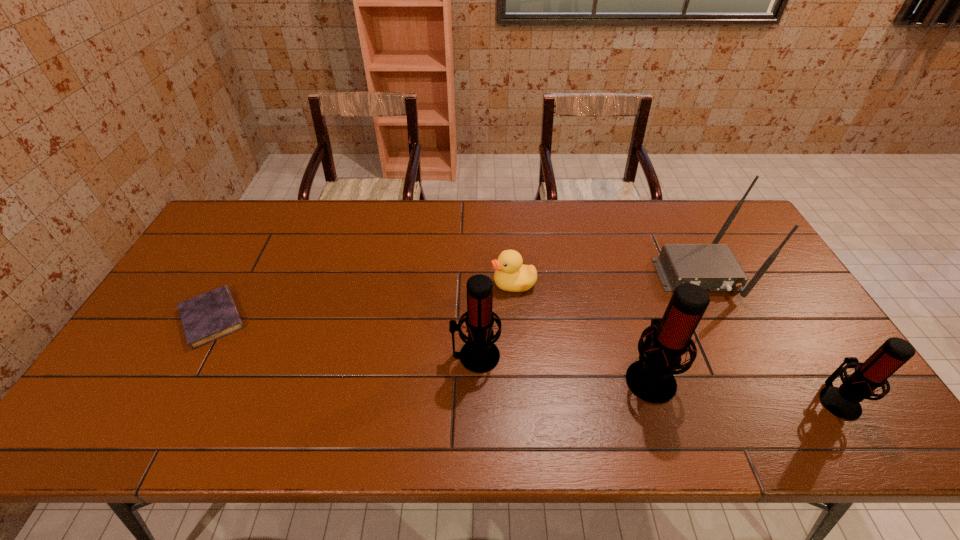
Where is `vacant space at the far edge`? The width and height of the screenshot is (960, 540). vacant space at the far edge is located at coordinates (418, 221).

This screenshot has height=540, width=960. I want to click on blank space at the near edge of the desktop, so click(732, 401).

In the image, there is a desktop. Identify the location of free space at the left edge. The width and height of the screenshot is (960, 540). (195, 261).

In the image, there is a desktop. At what (x,y) coordinates should I click in order to perform the action: click on vacant space at the right edge. Please return your answer as a coordinate pair (x, y). Image resolution: width=960 pixels, height=540 pixels. Looking at the image, I should click on (798, 327).

Where is `vacant space at the far left corner`? vacant space at the far left corner is located at coordinates (243, 201).

Where is `free space at the near right corner`? free space at the near right corner is located at coordinates (825, 379).

Where is `free space between the third object from right to left and the fourth tallest object`? The image size is (960, 540). free space between the third object from right to left and the fourth tallest object is located at coordinates (744, 388).

Locate an element on the screen. The image size is (960, 540). free space between the shortest microphone and the router is located at coordinates (768, 337).

The image size is (960, 540). Find the location of `free space between the fifth object from left to right and the duck`. free space between the fifth object from left to right and the duck is located at coordinates (606, 279).

At what (x,y) coordinates should I click in order to perform the action: click on vacant area between the rightmost microphone and the second microphone from right to left. Please return your answer as a coordinate pair (x, y). Image resolution: width=960 pixels, height=540 pixels. Looking at the image, I should click on (744, 388).